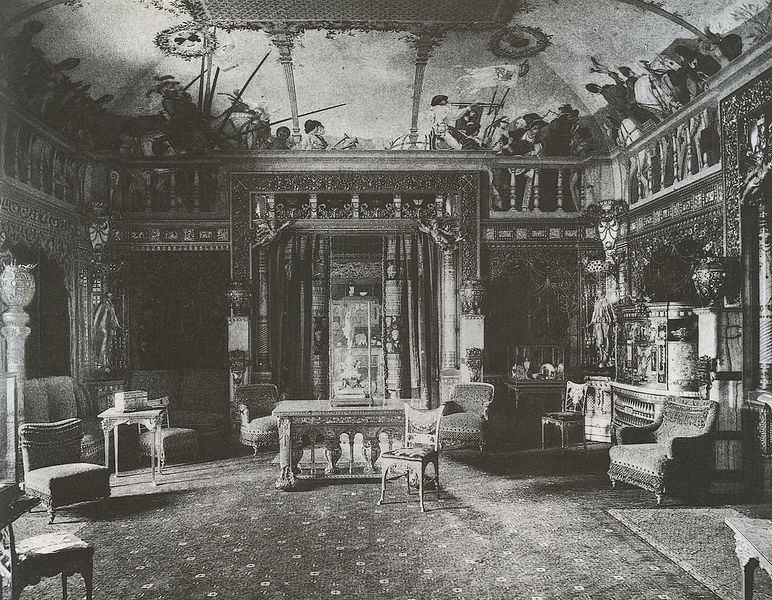
I want to click on chairs, so click(421, 461), click(638, 461), click(476, 420), click(251, 424), click(26, 544).